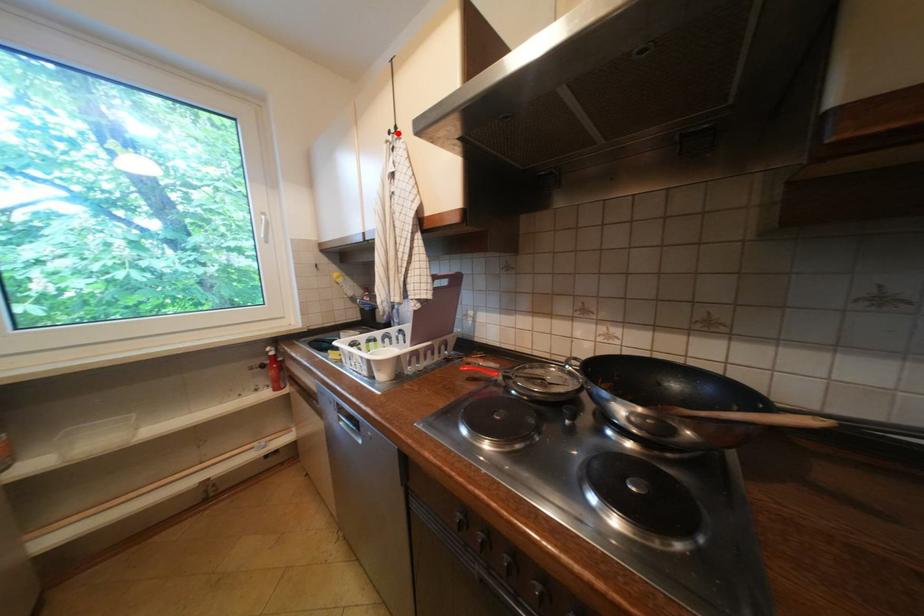
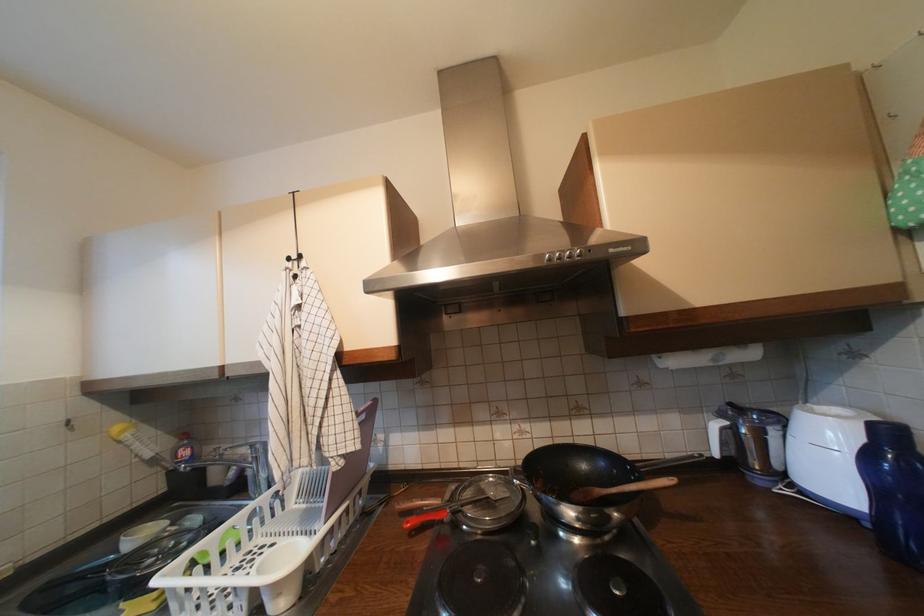
Where in the second image is the point corresponding to the highlighted location from the first image?

(297, 260)